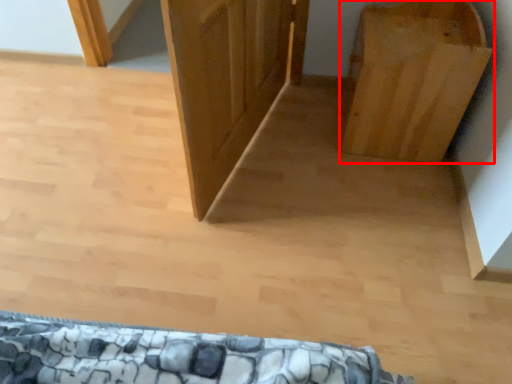
Question: From the image's perspective, what is the correct spatial relationship of furniture (annotated by the red box) in relation to door?

Choices:
 (A) below
 (B) above

Answer: (B)